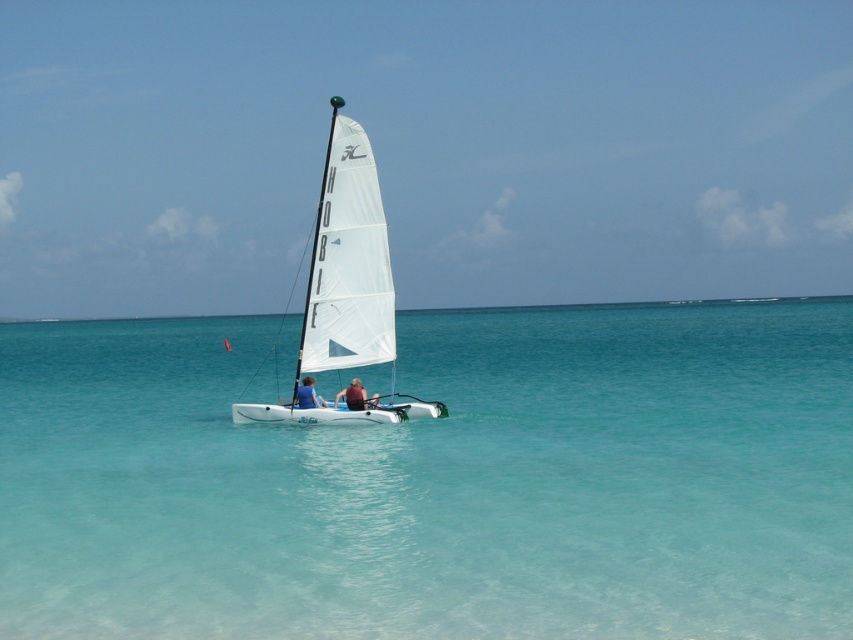
You are a photographer trying to capture the blue fabric sailboat at center from the shore. You notice the clear blue water at center in the foreground. Will the sailboat appear smaller or larger in your photo compared to the water?

The clear blue water at center is taller than the blue fabric sailboat at center, so the sailboat will appear smaller in the photo compared to the water.